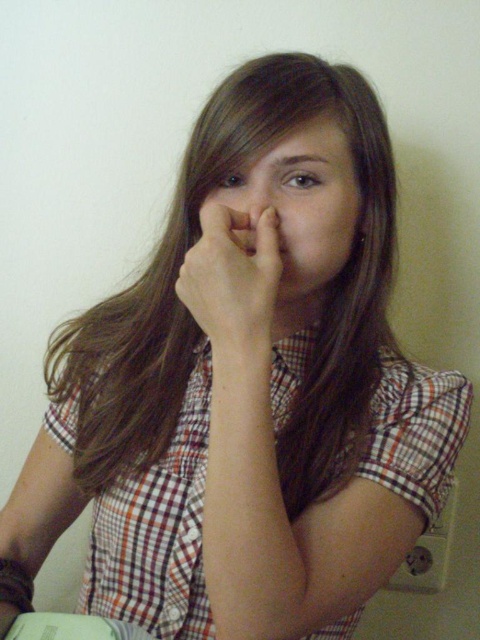
Is plaid cotton shirt at center shorter than matte skin nose at center?

In fact, plaid cotton shirt at center may be taller than matte skin nose at center.

Is plaid cotton shirt at center wider than matte skin nose at center?

Yes, plaid cotton shirt at center is wider than matte skin nose at center.

Image resolution: width=480 pixels, height=640 pixels. In order to click on plaid cotton shirt at center in this screenshot , I will do `click(157, 531)`.

Who is more distant from viewer, (x=348, y=214) or (x=267, y=317)?

Point (x=348, y=214)

Is matte skin nose at center smaller than smooth skin hand at center?

Actually, matte skin nose at center might be larger than smooth skin hand at center.

Does point (240, 216) lie in front of point (180, 276)?

No, (240, 216) is behind (180, 276).

Find the location of a particular element. The width and height of the screenshot is (480, 640). matte skin nose at center is located at coordinates (296, 205).

Does matte skin nose at center lie behind smooth flesh nose at center?

No, it is in front of smooth flesh nose at center.

Who is more forward, (349,182) or (252,208)?

Positioned in front is point (252,208).

Is point (247, 225) positioned in front of point (253, 188)?

Yes.

This screenshot has width=480, height=640. I want to click on matte skin nose at center, so click(x=296, y=205).